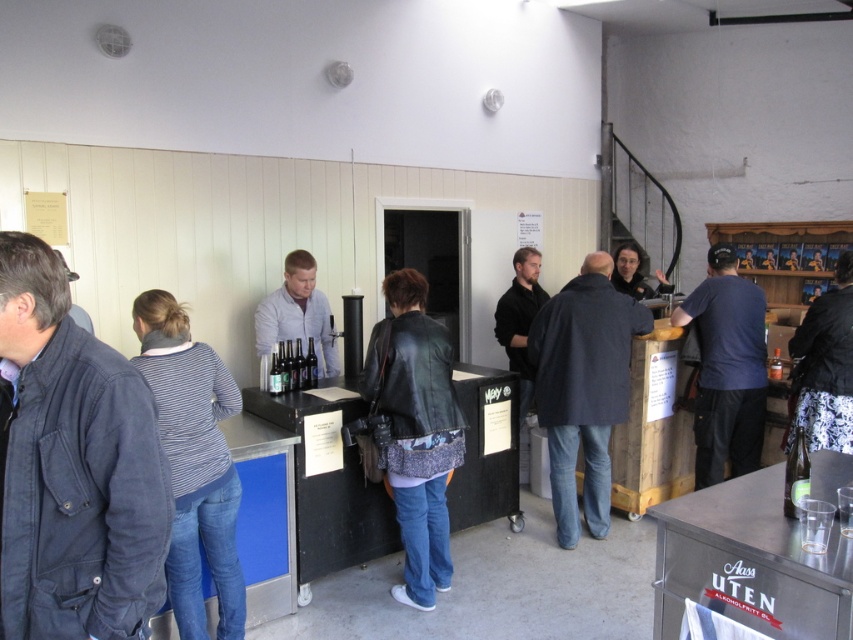
Is point (729, 406) positioned after point (262, 344)?

No.

Where is `dark blue shirt at right`? Image resolution: width=853 pixels, height=640 pixels. dark blue shirt at right is located at coordinates (726, 369).

The image size is (853, 640). What are the coordinates of `black leather jacket at right` in the screenshot? It's located at (825, 365).

Does black leather jacket at right appear on the left side of light gray sweater at center?

In fact, black leather jacket at right is to the right of light gray sweater at center.

Identify the location of black leather jacket at right. (825, 365).

In the scene shown: Who is higher up, black leather jacket at center or light gray sweater at center?

light gray sweater at center is higher up.

Which is behind, point (403, 388) or point (306, 262)?

Positioned behind is point (306, 262).

Between point (412, 285) and point (297, 301), which one is positioned in front?

Positioned in front is point (412, 285).

Locate an element on the screen. The height and width of the screenshot is (640, 853). black leather jacket at center is located at coordinates (415, 432).